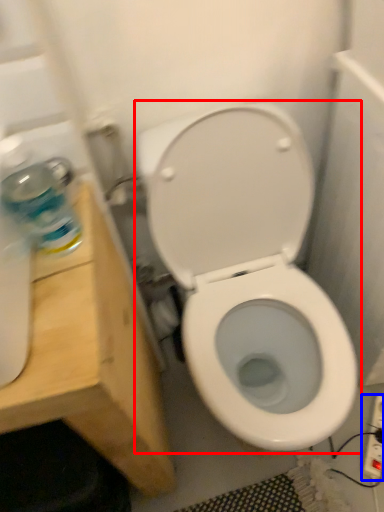
Question: Among these objects, which one is farthest to the camera, toilet (highlighted by a red box) or electric outlet (highlighted by a blue box)?

Choices:
 (A) toilet
 (B) electric outlet

Answer: (B)